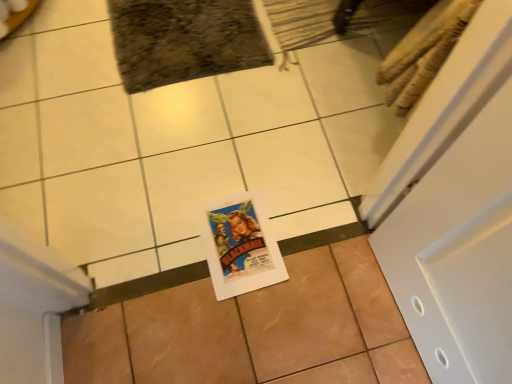
You are a GUI agent. You are given a task and a screenshot of the screen. Output one action in this format:
    pyautogui.click(x=<x>, y=<y>)
    Task: Click on the free space above brown glossy tile at center, which ranks as the 1th ceramic tile in bottom-to-top order (from a real-world perspective)
    The image size is (512, 384).
    Given the screenshot: What is the action you would take?
    pyautogui.click(x=264, y=334)